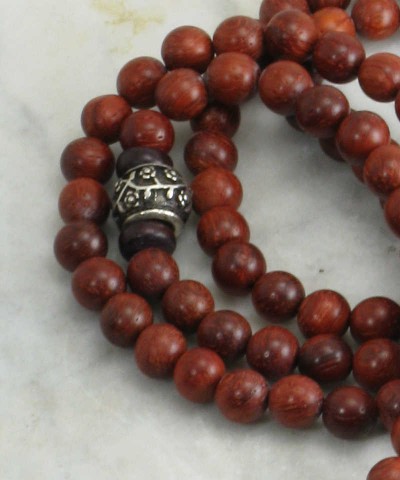
I want to click on shadows on countertop, so click(110, 355), click(74, 320), click(59, 275), click(320, 167), click(287, 139), click(358, 188).